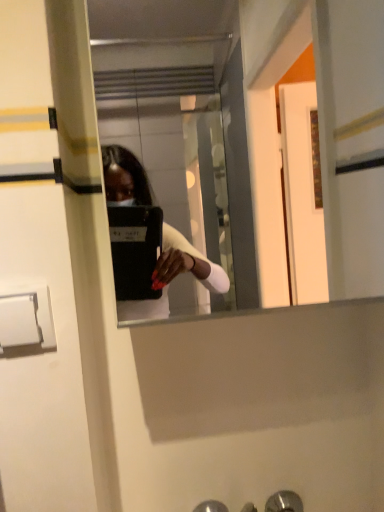
Question: Does clear glass mirror at center have a lesser width compared to white plastic door handle at lower left, which ranks as the 2th door handle in right-to-left order?

Choices:
 (A) yes
 (B) no

Answer: (B)

Question: Is clear glass mirror at center not within white plastic door handle at lower left, which ranks as the 2th door handle in back-to-front order?

Choices:
 (A) no
 (B) yes

Answer: (B)

Question: Considering the relative sizes of clear glass mirror at center and white plastic door handle at lower left, the first door handle in the top-to-bottom sequence, in the image provided, is clear glass mirror at center wider than white plastic door handle at lower left, the first door handle in the top-to-bottom sequence,?

Choices:
 (A) yes
 (B) no

Answer: (A)

Question: Would you say white plastic door handle at lower left, which ranks as the 2th door handle in right-to-left order, is part of clear glass mirror at center's contents?

Choices:
 (A) yes
 (B) no

Answer: (B)

Question: From a real-world perspective, is clear glass mirror at center physically above white plastic door handle at lower left, the 1th door handle from the left?

Choices:
 (A) yes
 (B) no

Answer: (A)

Question: Considering the positions of white plastic door handle at lower left, placed as the second door handle when sorted from bottom to top, and clear glass mirror at center in the image, is white plastic door handle at lower left, placed as the second door handle when sorted from bottom to top, bigger or smaller than clear glass mirror at center?

Choices:
 (A) big
 (B) small

Answer: (B)

Question: From the image's perspective, is white plastic door handle at lower left, the 1th door handle from the left, above or below clear glass mirror at center?

Choices:
 (A) below
 (B) above

Answer: (A)

Question: In the image, is white plastic door handle at lower left, the 1th door handle from the front, positioned in front of or behind clear glass mirror at center?

Choices:
 (A) front
 (B) behind

Answer: (B)

Question: Is white plastic door handle at lower left, placed as the second door handle when sorted from bottom to top, taller or shorter than clear glass mirror at center?

Choices:
 (A) tall
 (B) short

Answer: (B)

Question: Looking at their shapes, would you say metallic silver door handle at lower center, which is the first door handle in right-to-left order, is wider or thinner than white plastic door handle at lower left, the 1th door handle from the front?

Choices:
 (A) thin
 (B) wide

Answer: (B)

Question: Is point [x=276, y=495] positioned closer to the camera than point [x=49, y=311]?

Choices:
 (A) closer
 (B) farther

Answer: (B)

Question: From the image's perspective, is metallic silver door handle at lower center, marked as the second door handle in a front-to-back arrangement, above or below white plastic door handle at lower left, which ranks as the 2th door handle in back-to-front order?

Choices:
 (A) above
 (B) below

Answer: (B)

Question: Looking at the image, does metallic silver door handle at lower center, marked as the second door handle in a front-to-back arrangement, seem bigger or smaller compared to white plastic door handle at lower left, which ranks as the 2th door handle in right-to-left order?

Choices:
 (A) small
 (B) big

Answer: (B)

Question: From the image's perspective, is white plastic door handle at lower left, the 1th door handle from the front, above or below metallic silver door handle at lower center, positioned as the 2th door handle in left-to-right order?

Choices:
 (A) below
 (B) above

Answer: (B)

Question: From their relative heights in the image, would you say white plastic door handle at lower left, which ranks as the 2th door handle in back-to-front order, is taller or shorter than metallic silver door handle at lower center, the 1th door handle in the back-to-front sequence?

Choices:
 (A) tall
 (B) short

Answer: (A)